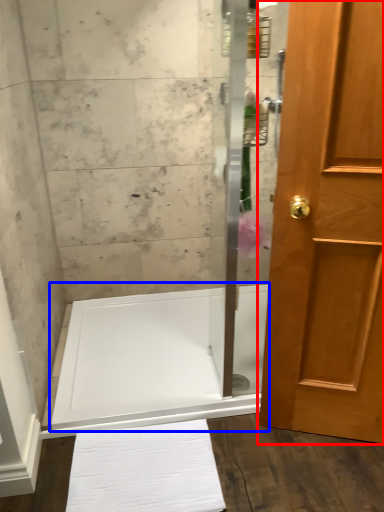
Question: Which point is closer to the camera, door (highlighted by a red box) or bath (highlighted by a blue box)?

Choices:
 (A) door
 (B) bath

Answer: (A)